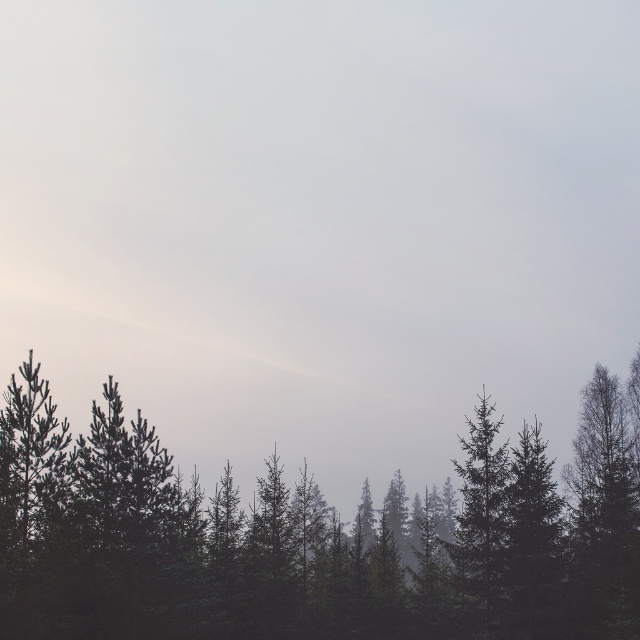
Question: Is dark green trees at lower center above green matte tree at center?

Choices:
 (A) no
 (B) yes

Answer: (A)

Question: Can you confirm if dark green trees at lower center is wider than green matte tree at center?

Choices:
 (A) yes
 (B) no

Answer: (A)

Question: Which point is farther from the camera taking this photo?

Choices:
 (A) (452, 460)
 (B) (314, 561)

Answer: (B)

Question: Which object appears farthest from the camera in this image?

Choices:
 (A) green matte tree at center
 (B) dark green trees at lower center

Answer: (A)

Question: Can you confirm if dark green trees at lower center is wider than green matte tree at center?

Choices:
 (A) no
 (B) yes

Answer: (B)